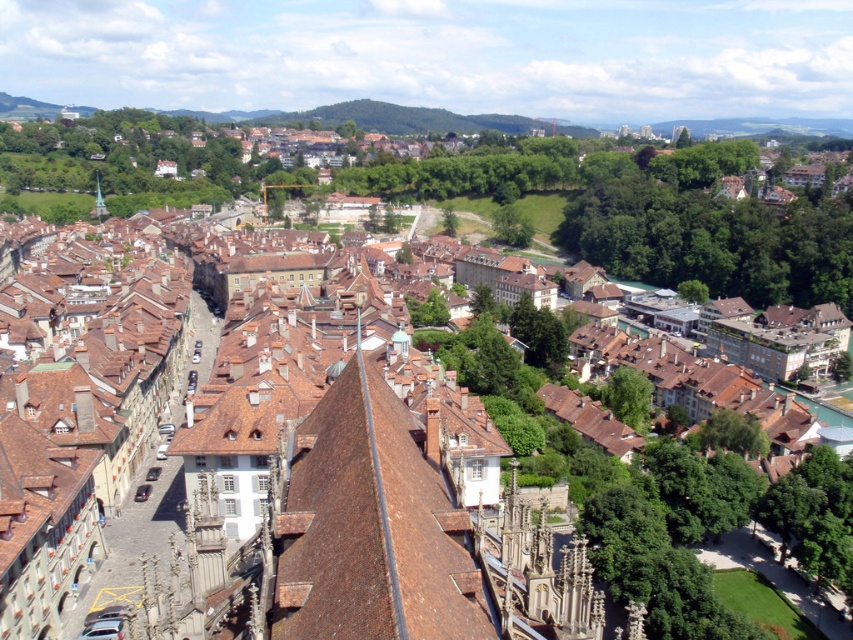
Question: Is brown tile roof at center further to the viewer compared to green wooden tower at center?

Choices:
 (A) no
 (B) yes

Answer: (A)

Question: Which of the following is the closest to the observer?

Choices:
 (A) (97, 218)
 (B) (326, 588)

Answer: (B)

Question: Which of the following is the closest to the observer?

Choices:
 (A) (361, 586)
 (B) (97, 218)

Answer: (A)

Question: Does brown tile roof at center come behind green wooden tower at center?

Choices:
 (A) yes
 (B) no

Answer: (B)

Question: Which point is closer to the camera?

Choices:
 (A) brown tile roof at center
 (B) green wooden tower at center

Answer: (A)

Question: Is brown tile roof at center in front of green wooden tower at center?

Choices:
 (A) yes
 (B) no

Answer: (A)